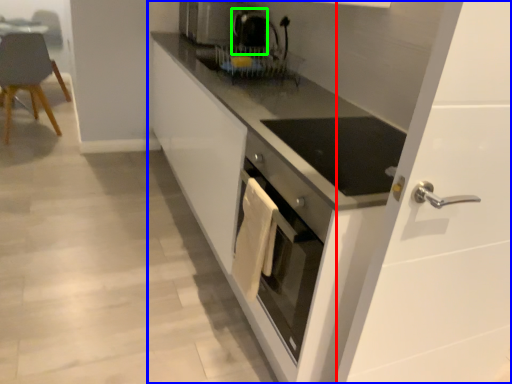
Question: Estimate the real-world distances between objects in this image. Which object is farther from glass door (highlighted by a red box), cabinetry (highlighted by a blue box) or coffee machine (highlighted by a green box)?

Choices:
 (A) cabinetry
 (B) coffee machine

Answer: (B)